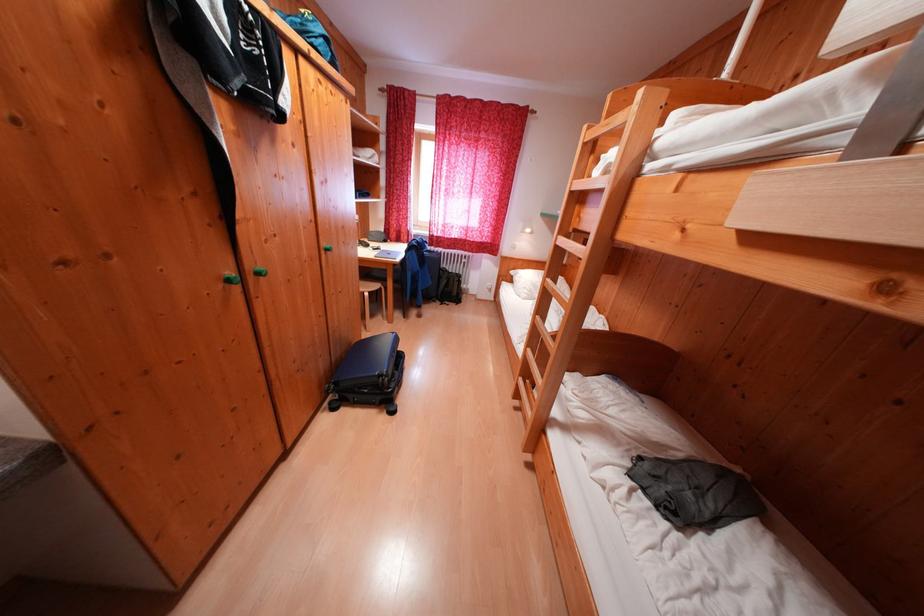
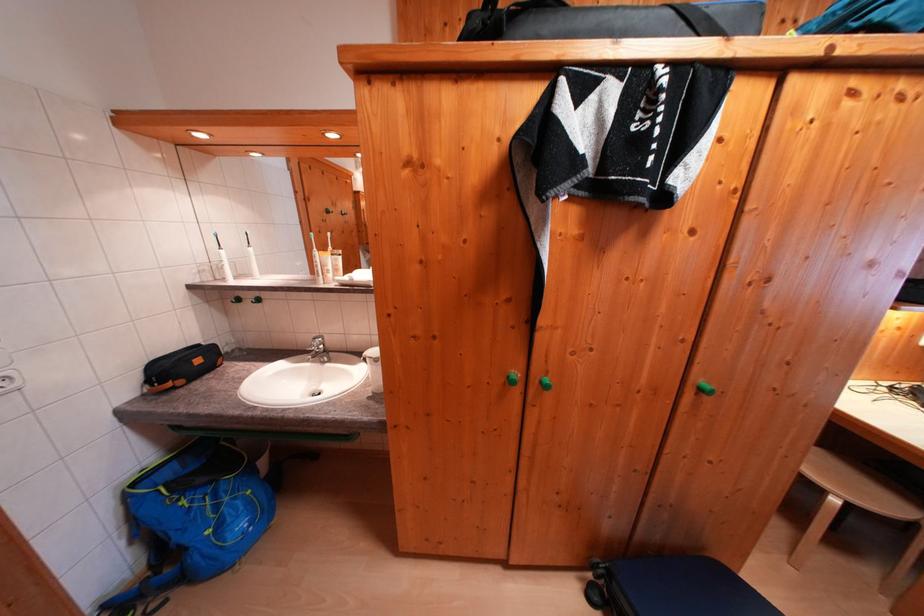
Where in the second image is the point corresponding to [342,413] from the first image?

(598, 602)